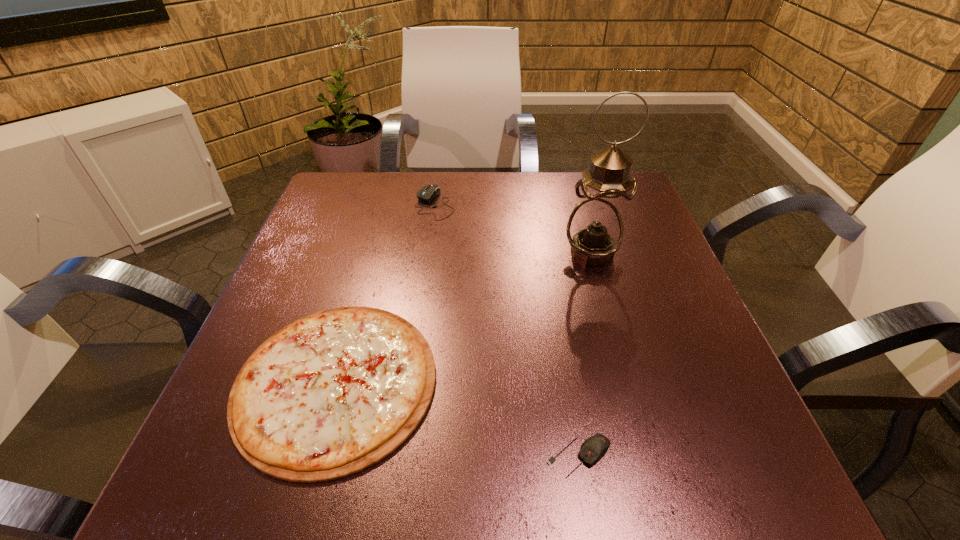
Locate an element on the screen. The width and height of the screenshot is (960, 540). oil lamp is located at coordinates (595, 229).

Image resolution: width=960 pixels, height=540 pixels. In order to click on the tallest object in this screenshot , I will do `click(595, 229)`.

The width and height of the screenshot is (960, 540). In order to click on the left mouse in this screenshot , I will do `click(427, 193)`.

The image size is (960, 540). In order to click on the farthest object in this screenshot , I will do `click(427, 193)`.

I want to click on the nearer mouse, so click(x=595, y=447).

Find the location of a particular element. the right mouse is located at coordinates (595, 447).

The image size is (960, 540). I want to click on the shortest object, so (333, 393).

Find the location of a particular element. vacant space located 0.060m on the right of the third nearest object is located at coordinates coord(646,252).

Locate an element on the screen. The height and width of the screenshot is (540, 960). vacant space located 0.230m on the left of the taller mouse is located at coordinates (324, 204).

In order to click on free space located on the left of the shorter mouse in this screenshot , I will do pyautogui.click(x=443, y=457).